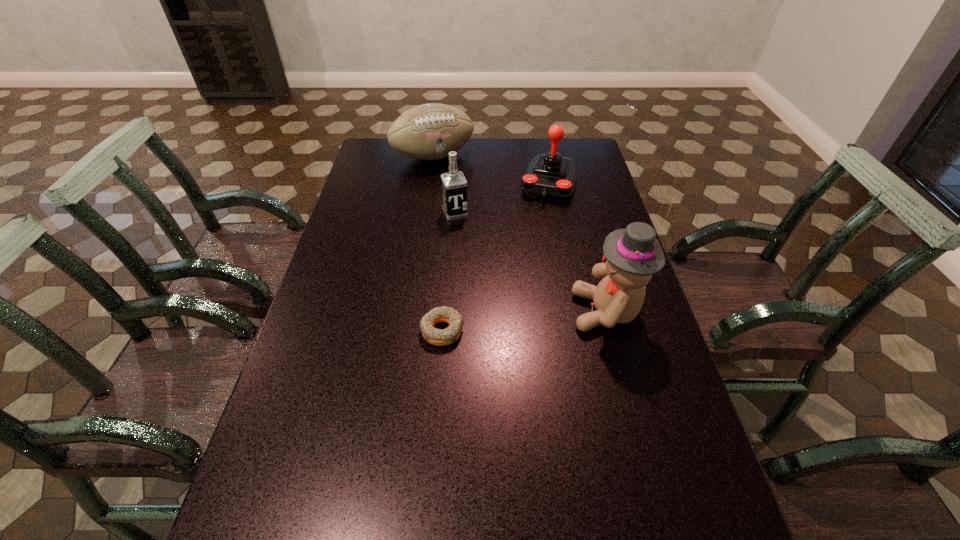
Locate an element on the screen. This screenshot has height=540, width=960. object present at the left edge is located at coordinates (427, 132).

Locate an element on the screen. This screenshot has height=540, width=960. rag_doll positioned at the right edge is located at coordinates (632, 255).

Locate an element on the screen. Image resolution: width=960 pixels, height=540 pixels. joystick located at the right edge is located at coordinates (549, 176).

The image size is (960, 540). Identify the location of object that is at the far left corner. (427, 132).

The height and width of the screenshot is (540, 960). Identify the location of object present at the far right corner. (549, 176).

Identify the location of vacant space at the far edge. (514, 152).

Where is `free region at the near edge of the desktop`? free region at the near edge of the desktop is located at coordinates (623, 508).

This screenshot has height=540, width=960. I want to click on vacant space at the left edge of the desktop, so click(x=386, y=172).

Locate an element on the screen. This screenshot has width=960, height=540. vacant space at the right edge is located at coordinates (672, 454).

Where is `vacant region at the far left corner`? This screenshot has height=540, width=960. vacant region at the far left corner is located at coordinates (399, 157).